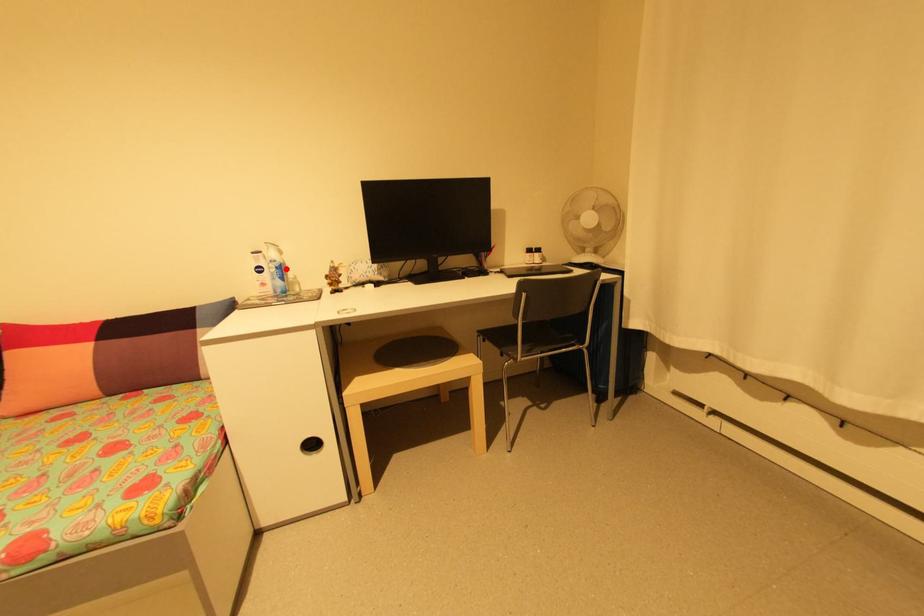
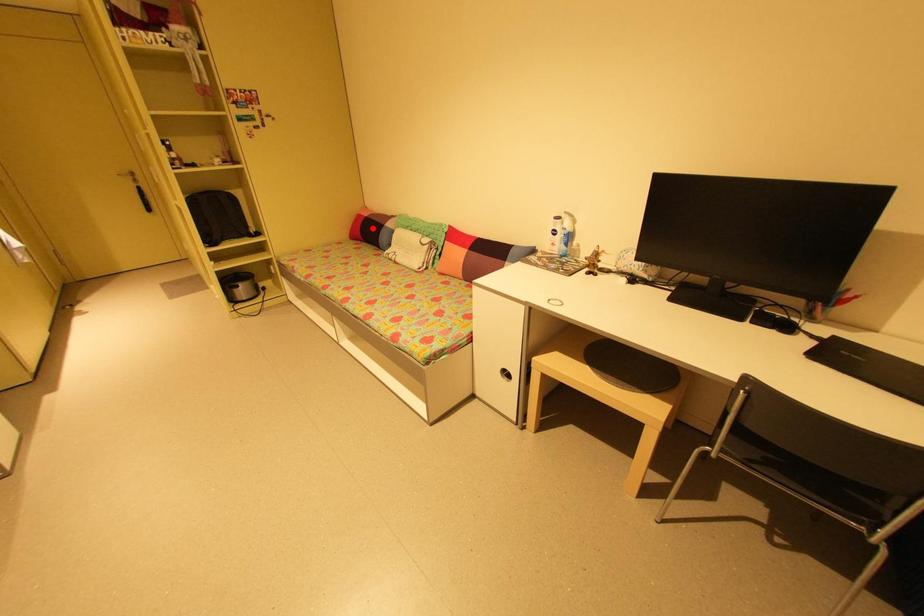
I am providing you with two images of the same scene from different viewpoints. A red point is marked on the first image and another point is marked on the second image. Are the points marked in image1 and image2 representing the same 3D position?

No